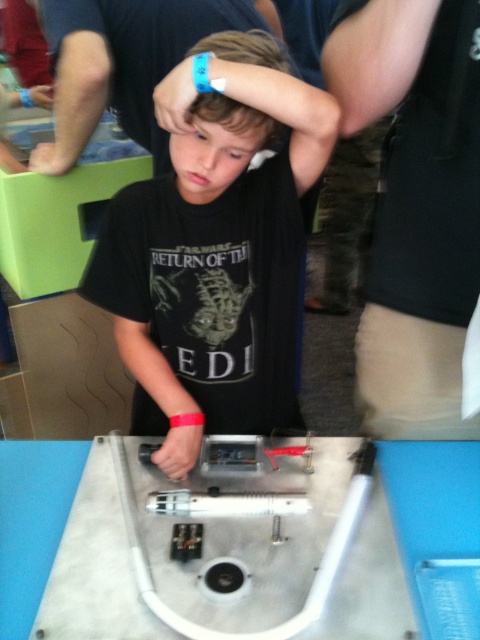
You are looking at the image of the boy and the table. There are two points marked on the table surface. One is at coordinate point (52, 44) and the other is at point (247, 35). From your perspective, which point is closer to you?

Point (52, 44) is further to the camera than point (247, 35), so the point closer to you is point (247, 35).

You are a photographer standing 5 feet away from the blue wristband at upper center. You want to take a closeup shot of it. Can you move closer to get a better shot without exceeding the maximum allowed distance of 3.81 feet?

The blue wristband at upper center and viewer are 3.81 feet apart from each other. Since you are already standing 5 feet away, moving closer to 3.81 feet would be allowed, but you cannot go any closer than that as it is the maximum allowed distance.

The user is trying to determine the spatial relationship between the black matte shirt at center and the blue wristband at upper center. Which object is positioned lower in the image?

The black matte shirt at center is located below the blue wristband at upper center, so the black matte shirt at center is positioned lower in the image.